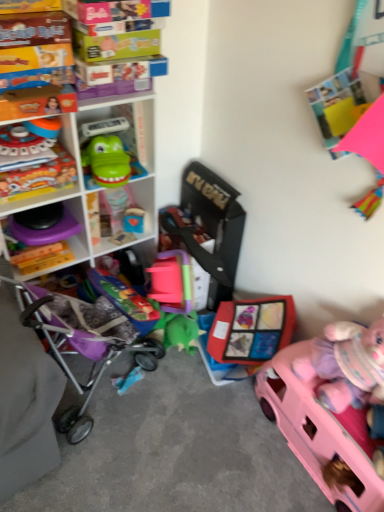
Locate an element on the screen. white plastic shelf at upper left, the second shelf from the bottom is located at coordinates [x=71, y=146].

The width and height of the screenshot is (384, 512). Describe the element at coordinates (251, 329) in the screenshot. I see `matte plastic toy at center, arranged as the fifth toy when viewed from the left` at that location.

What do you see at coordinates (107, 161) in the screenshot?
I see `green rubber toy at center-left, the 3th toy viewed from the left` at bounding box center [107, 161].

This screenshot has height=512, width=384. Describe the element at coordinates (29, 137) in the screenshot. I see `matte plastic toy at left, acting as the sixth toy starting from the right` at that location.

The width and height of the screenshot is (384, 512). In order to click on white plastic shelf at upper left, positioned as the 1th shelf in top-to-bottom order in this screenshot , I will do `click(71, 146)`.

From the purple fabric baby carriage at lower left, count 2nd toys backward and point to it. Please provide its 2D coordinates.

[(29, 137)]

Is purple fabric baby carriage at lower left bigger than matte plastic toy at left, the 1th toy from the left?

Indeed, purple fabric baby carriage at lower left has a larger size compared to matte plastic toy at left, the 1th toy from the left.

Who is shorter, purple fabric baby carriage at lower left or matte plastic toy at left, the 1th toy from the left?

With less height is matte plastic toy at left, the 1th toy from the left.

Is purple fabric baby carriage at lower left spatially inside matte plastic toy at left, the 1th toy from the left, or outside of it?

purple fabric baby carriage at lower left cannot be found inside matte plastic toy at left, the 1th toy from the left.

Is white plastic shelf at upper left, the second shelf from the bottom, in front of or behind purple fabric baby carriage at lower left in the image?

white plastic shelf at upper left, the second shelf from the bottom, is behind purple fabric baby carriage at lower left.

Image resolution: width=384 pixels, height=512 pixels. I want to click on shelf positioned vertically above the purple fabric baby carriage at lower left (from a real-world perspective), so click(71, 146).

Which object is wider, white plastic shelf at upper left, positioned as the 1th shelf in top-to-bottom order, or purple fabric baby carriage at lower left?

purple fabric baby carriage at lower left is wider.

Is white plastic shelf at upper left, positioned as the 1th shelf in top-to-bottom order, located outside purple fabric baby carriage at lower left?

That's correct, white plastic shelf at upper left, positioned as the 1th shelf in top-to-bottom order, is outside of purple fabric baby carriage at lower left.

In the image, is purple plastic toy at left, which is counted as the 1th shelf, starting from the bottom, positioned in front of or behind purple fabric baby carriage at lower left?

Clearly, purple plastic toy at left, which is counted as the 1th shelf, starting from the bottom, is behind purple fabric baby carriage at lower left.

In terms of height, does purple plastic toy at left, which appears as the 2th shelf when viewed from the top, look taller or shorter compared to purple fabric baby carriage at lower left?

Clearly, purple plastic toy at left, which appears as the 2th shelf when viewed from the top, is shorter compared to purple fabric baby carriage at lower left.

Between purple plastic toy at left, which appears as the 2th shelf when viewed from the top, and purple fabric baby carriage at lower left, which one has larger width?

purple fabric baby carriage at lower left is wider.

Does purple plastic toy at left, which appears as the 2th shelf when viewed from the top, have a larger size compared to purple fabric baby carriage at lower left?

Actually, purple plastic toy at left, which appears as the 2th shelf when viewed from the top, might be smaller than purple fabric baby carriage at lower left.

Is purple plastic toy at left, which appears as the 2th shelf when viewed from the top, beside matte plastic toy at center, arranged as the fifth toy when viewed from the left?

No, purple plastic toy at left, which appears as the 2th shelf when viewed from the top, is not in contact with matte plastic toy at center, arranged as the fifth toy when viewed from the left.

Locate an element on the screen. toy that is the 3rd one below the purple plastic toy at left, which is counted as the 1th shelf, starting from the bottom (from a real-world perspective) is located at coordinates (251, 329).

Considering the points (56, 213) and (233, 314), which point is in front, point (56, 213) or point (233, 314)?

The point (56, 213) is more forward.

Based on the photo, considering the sizes of objects purple plastic toy at left, which is counted as the 1th shelf, starting from the bottom, and matte plastic toy at center, arranged as the fifth toy when viewed from the left, in the image provided, who is smaller, purple plastic toy at left, which is counted as the 1th shelf, starting from the bottom, or matte plastic toy at center, arranged as the fifth toy when viewed from the left,?

matte plastic toy at center, arranged as the fifth toy when viewed from the left.

Is point (48, 187) farther from viewer compared to point (227, 360)?

No, it is not.

Is the position of white plastic shelf at upper left, positioned as the 1th shelf in top-to-bottom order, less distant than that of matte plastic toy at center, arranged as the fifth toy when viewed from the left?

Yes, it is.

Are white plastic shelf at upper left, the second shelf from the bottom, and matte plastic toy at center, arranged as the fifth toy when viewed from the left, far apart?

They are positioned close to each other.

Is white plastic shelf at upper left, the second shelf from the bottom, facing towards matte plastic toy at center, acting as the second toy starting from the right?

Yes.

Which of these two, green rubber toy at center-left, the 3th toy viewed from the left, or white plastic shelf at upper left, positioned as the 1th shelf in top-to-bottom order, is wider?

white plastic shelf at upper left, positioned as the 1th shelf in top-to-bottom order, is wider.

From a real-world perspective, is green rubber toy at center-left, marked as the fourth toy in a right-to-left arrangement, below white plastic shelf at upper left, the second shelf from the bottom?

Actually, green rubber toy at center-left, marked as the fourth toy in a right-to-left arrangement, is physically above white plastic shelf at upper left, the second shelf from the bottom, in the real world.

Considering the relative sizes of green rubber toy at center-left, the 3th toy viewed from the left, and white plastic shelf at upper left, positioned as the 1th shelf in top-to-bottom order, in the image provided, is green rubber toy at center-left, the 3th toy viewed from the left, smaller than white plastic shelf at upper left, positioned as the 1th shelf in top-to-bottom order,?

Indeed, green rubber toy at center-left, the 3th toy viewed from the left, has a smaller size compared to white plastic shelf at upper left, positioned as the 1th shelf in top-to-bottom order.

Is matte plastic toy at center, arranged as the fifth toy when viewed from the left, directly adjacent to purple fabric baby carriage at lower left?

No, matte plastic toy at center, arranged as the fifth toy when viewed from the left, is not next to purple fabric baby carriage at lower left.

Is matte plastic toy at center, acting as the second toy starting from the right, shorter than purple fabric baby carriage at lower left?

Yes, matte plastic toy at center, acting as the second toy starting from the right, is shorter than purple fabric baby carriage at lower left.

Is matte plastic toy at center, acting as the second toy starting from the right, facing towards purple fabric baby carriage at lower left?

Yes, matte plastic toy at center, acting as the second toy starting from the right, is aimed at purple fabric baby carriage at lower left.

Find the location of a particular element. Image resolution: width=384 pixels, height=512 pixels. baby carriage located below the matte plastic toy at left, the 1th toy from the left (from the image's perspective) is located at coordinates (85, 343).

Where is `the 1st shelf to the left of the purple fabric baby carriage at lower left, counting from the anchor's position`? This screenshot has height=512, width=384. the 1st shelf to the left of the purple fabric baby carriage at lower left, counting from the anchor's position is located at coordinates (71, 146).

Looking at the image, which one is located further to wooden block at center, arranged as the 4th toy when viewed from the left, purple plastic toy at left, which appears as the 2th shelf when viewed from the top, or purple fabric baby carriage at lower left?

purple fabric baby carriage at lower left lies further to wooden block at center, arranged as the 4th toy when viewed from the left, than the other object.

Considering their positions, is green rubber toy at center-left, marked as the fourth toy in a right-to-left arrangement, positioned closer to wooden block at center, which appears as the 3th toy when viewed from the right, than purple plastic toy at left, which is counted as the 1th shelf, starting from the bottom?

Among the two, green rubber toy at center-left, marked as the fourth toy in a right-to-left arrangement, is located nearer to wooden block at center, which appears as the 3th toy when viewed from the right.

Which object lies nearer to the anchor point matte plastic toy at left, which appears as the fifth toy when viewed from the right, purple fabric baby carriage at lower left or pink plastic car at lower right, acting as the first toy starting from the right?

purple fabric baby carriage at lower left lies closer to matte plastic toy at left, which appears as the fifth toy when viewed from the right, than the other object.

Which object lies further to the anchor point matte plastic toy at center, arranged as the fifth toy when viewed from the left, wooden block at center, which appears as the 3th toy when viewed from the right, or purple fabric baby carriage at lower left?

wooden block at center, which appears as the 3th toy when viewed from the right.

From the image, which object appears to be farther from pink plastic car at lower right, acting as the first toy starting from the right, wooden block at center, which appears as the 3th toy when viewed from the right, or matte plastic toy at left, acting as the sixth toy starting from the right?

The object further to pink plastic car at lower right, acting as the first toy starting from the right, is matte plastic toy at left, acting as the sixth toy starting from the right.

Considering their positions, is matte plastic toy at left, which appears as the fifth toy when viewed from the right, positioned closer to white plastic shelf at upper left, the second shelf from the bottom, than green rubber toy at center-left, the 3th toy viewed from the left?

matte plastic toy at left, which appears as the fifth toy when viewed from the right, lies closer to white plastic shelf at upper left, the second shelf from the bottom, than the other object.

From the image, which object appears to be nearer to white plastic shelf at upper left, the second shelf from the bottom, purple fabric baby carriage at lower left or green rubber toy at center-left, the 3th toy viewed from the left?

Based on the image, green rubber toy at center-left, the 3th toy viewed from the left, appears to be nearer to white plastic shelf at upper left, the second shelf from the bottom.

Considering their positions, is wooden block at center, arranged as the 4th toy when viewed from the left, positioned further to matte plastic toy at left, the 2th toy viewed from the left, than purple plastic toy at left, which appears as the 2th shelf when viewed from the top?

wooden block at center, arranged as the 4th toy when viewed from the left, is positioned further to the anchor matte plastic toy at left, the 2th toy viewed from the left.

Find the location of a particular element. The image size is (384, 512). shelf between matte plastic toy at left, the 2th toy viewed from the left, and matte plastic toy at center, acting as the second toy starting from the right is located at coordinates (71, 146).

You are a GUI agent. You are given a task and a screenshot of the screen. Output one action in this format:
    pyautogui.click(x=<x>, y=<y>)
    Task: Click on the baby carriage between matte plastic toy at left, acting as the sixth toy starting from the right, and pink plastic car at lower right, positioned as the 6th toy in left-to-right order, from left to right
    This screenshot has width=384, height=512.
    Given the screenshot: What is the action you would take?
    pyautogui.click(x=85, y=343)

Find the location of a particular element. This screenshot has height=512, width=384. toy situated between matte plastic toy at left, acting as the sixth toy starting from the right, and green rubber toy at center-left, the 3th toy viewed from the left, from left to right is located at coordinates (39, 177).

Locate an element on the screen. baby carriage between purple plastic toy at left, which is counted as the 1th shelf, starting from the bottom, and pink plastic car at lower right, positioned as the 6th toy in left-to-right order, in the horizontal direction is located at coordinates (85, 343).